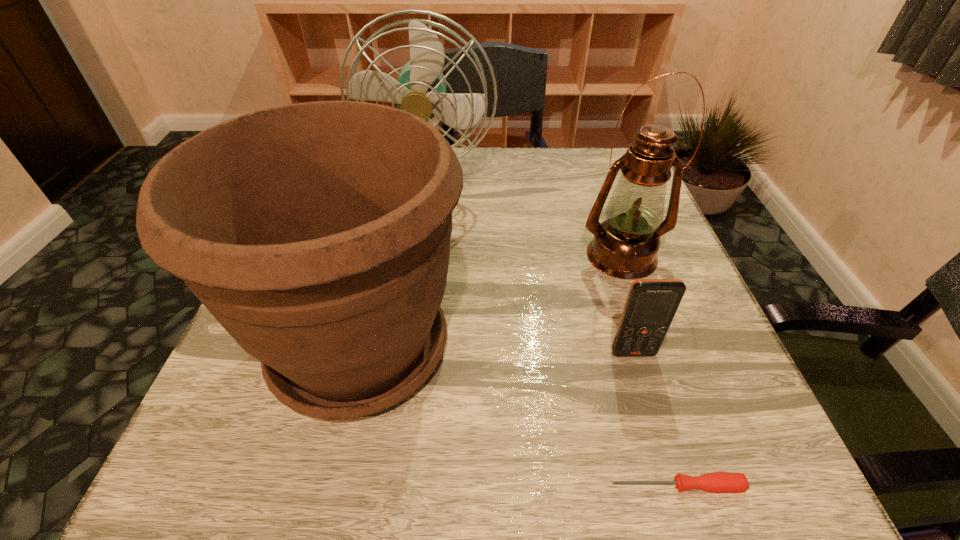
The image size is (960, 540). In order to click on vacant space situated 0.210m at the tip of the screwdriver in this screenshot , I will do `click(448, 486)`.

Where is `free location located at the tip of the screwdriver`? free location located at the tip of the screwdriver is located at coordinates (402, 486).

Where is `free space located at the tip of the screwdriver`? The image size is (960, 540). free space located at the tip of the screwdriver is located at coordinates (464, 486).

At what (x,y) coordinates should I click in order to perform the action: click on object that is at the far edge. Please return your answer as a coordinate pair (x, y). This screenshot has height=540, width=960. Looking at the image, I should click on (420, 89).

You are a GUI agent. You are given a task and a screenshot of the screen. Output one action in this format:
    pyautogui.click(x=<x>, y=<y>)
    Task: Click on the flowerpot at the near edge
    This screenshot has width=960, height=540.
    Given the screenshot: What is the action you would take?
    pyautogui.click(x=317, y=234)

Locate an element on the screen. This screenshot has height=540, width=960. screwdriver that is at the near edge is located at coordinates (720, 482).

Find the location of a particular element. The width and height of the screenshot is (960, 540). fan at the left edge is located at coordinates (420, 89).

Find the location of `flowerpot that is at the left edge`. flowerpot that is at the left edge is located at coordinates (317, 234).

At what (x,y) coordinates should I click in order to perform the action: click on oil lamp that is at the right edge. Please return your answer as a coordinate pair (x, y). The width and height of the screenshot is (960, 540). Looking at the image, I should click on (625, 245).

Find the location of `cellular telephone that is positioned at the right edge`. cellular telephone that is positioned at the right edge is located at coordinates (651, 305).